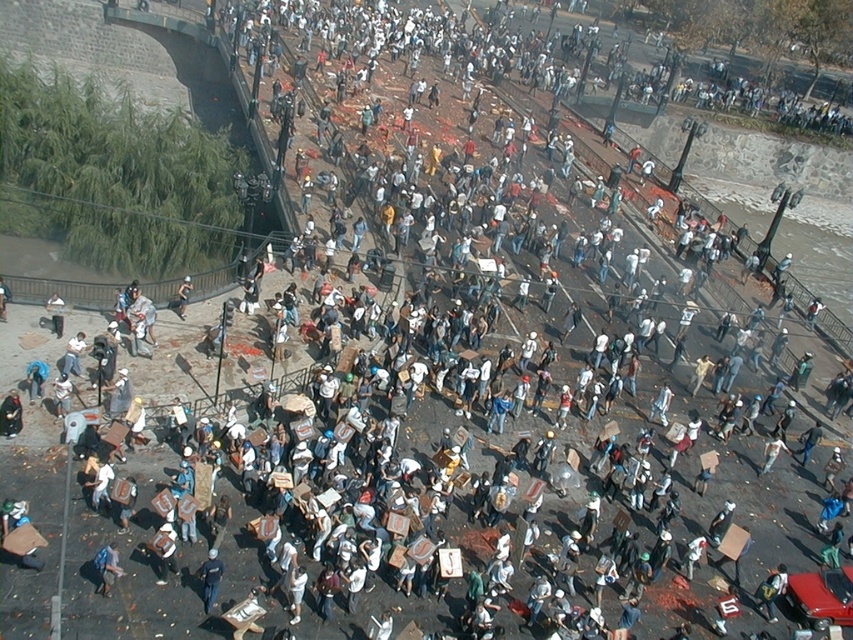
Question: Which point is farther to the camera?

Choices:
 (A) dark blue uniform at center
 (B) light blue denim jeans at lower left

Answer: (B)

Question: Is blue denim jeans at lower left to the right of light blue denim jeans at lower left from the viewer's perspective?

Choices:
 (A) no
 (B) yes

Answer: (B)

Question: Does blue denim jeans at lower left have a smaller size compared to light blue denim jeans at lower left?

Choices:
 (A) yes
 (B) no

Answer: (A)

Question: Is dark blue uniform at center below light blue denim jeans at lower left?

Choices:
 (A) no
 (B) yes

Answer: (B)

Question: Among these points, which one is farthest from the camera?

Choices:
 (A) (119, 561)
 (B) (209, 595)
 (C) (183, 314)

Answer: (C)

Question: Which point is closer to the camera?

Choices:
 (A) light blue denim jeans at lower left
 (B) blue denim jeans at lower left

Answer: (B)